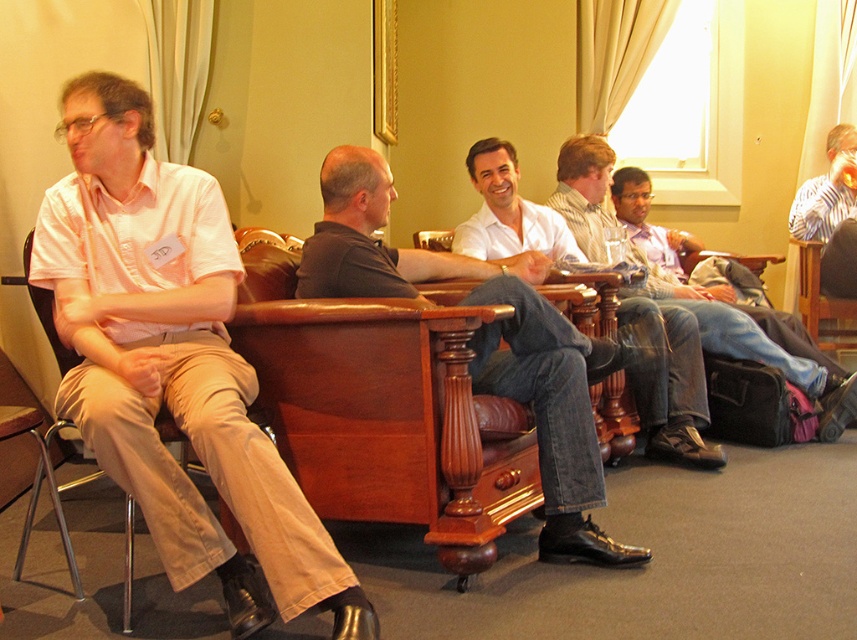
Question: Based on their relative distances, which object is farther from the denim jeans at center?

Choices:
 (A) white shirt at center
 (B) metallic silver armchair at left

Answer: (B)

Question: Which point is closer to the camera taking this photo?

Choices:
 (A) (342, 209)
 (B) (849, 160)
 (C) (27, 241)

Answer: (A)

Question: Is khaki pants at left smaller than metallic silver armchair at left?

Choices:
 (A) no
 (B) yes

Answer: (A)

Question: Can you confirm if khaki pants at left is positioned to the left of denim jeans at center?

Choices:
 (A) no
 (B) yes

Answer: (B)

Question: Among these objects, which one is nearest to the camera?

Choices:
 (A) metallic silver armchair at left
 (B) dark gray leather chair at center
 (C) khaki pants at left
 (D) striped shirt at upper right

Answer: (C)

Question: Is white shirt at center bigger than striped shirt at upper right?

Choices:
 (A) no
 (B) yes

Answer: (B)